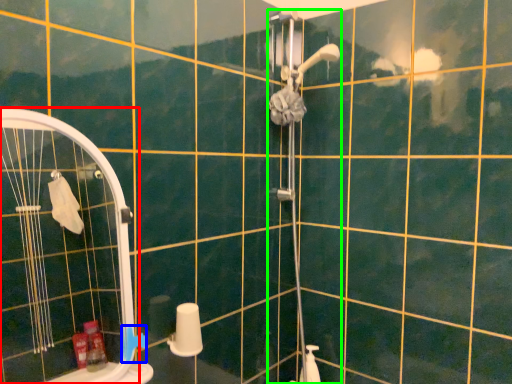
Question: Considering the real-world distances, which object is closest to screen door (highlighted by a red box)? towel bar (highlighted by a blue box) or shower door (highlighted by a green box).

Choices:
 (A) towel bar
 (B) shower door

Answer: (B)